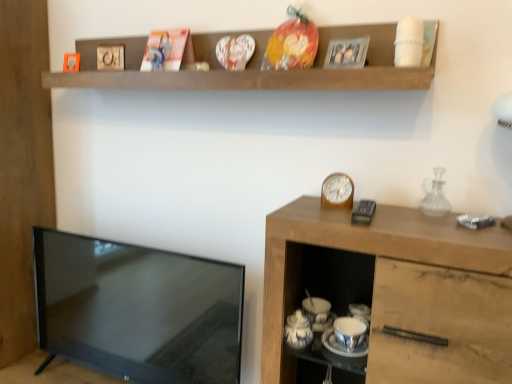
Image resolution: width=512 pixels, height=384 pixels. I want to click on vacant area that is in front of transparent glass carafe at right, so click(x=442, y=225).